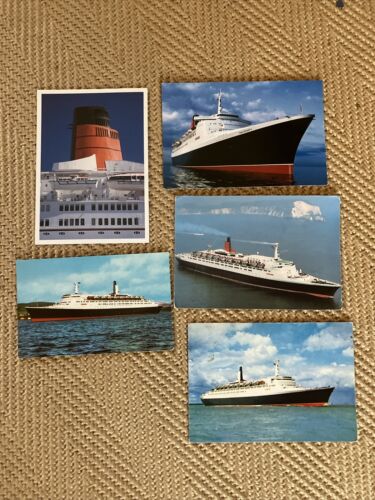
Locate an element on the screen. photographs on the right is located at coordinates (276, 390), (272, 248), (256, 106).